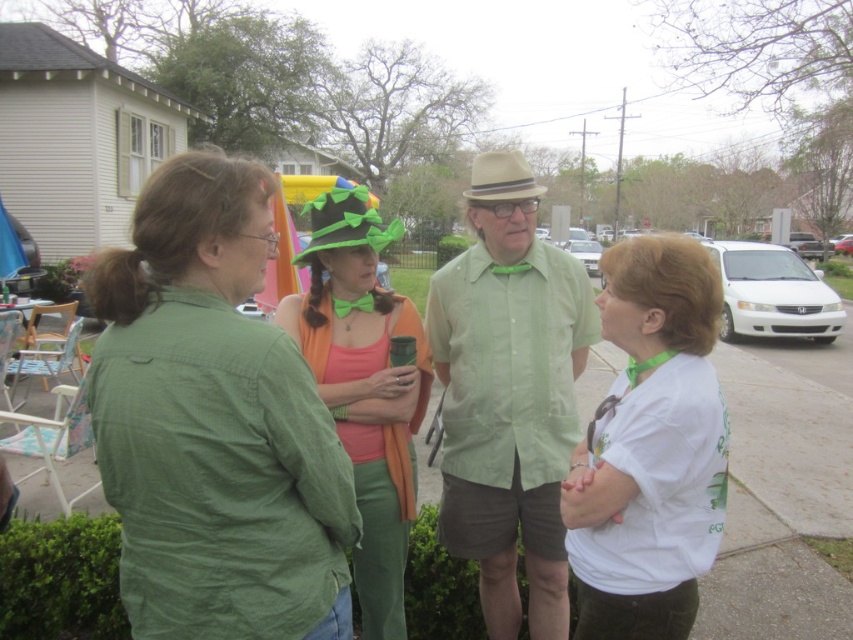
Image resolution: width=853 pixels, height=640 pixels. Describe the element at coordinates (650, 448) in the screenshot. I see `white matte shirt at center` at that location.

From the picture: Does white matte shirt at center come in front of green felt hat at center?

No, white matte shirt at center is further to the viewer.

Is point (625, 600) closer to viewer compared to point (392, 474)?

Yes, point (625, 600) is in front of point (392, 474).

At what (x,y) coordinates should I click in order to perform the action: click on white matte shirt at center. Please return your answer as a coordinate pair (x, y). The image size is (853, 640). Looking at the image, I should click on [650, 448].

Which is behind, point (224, 554) or point (358, 406)?

Positioned behind is point (358, 406).

Between point (195, 404) and point (328, 394), which one is positioned behind?

The point (328, 394) is more distant.

Locate an element on the screen. green matte shirt at left is located at coordinates (213, 422).

Can you confirm if green matte shirt at left is shorter than white matte shirt at center?

Yes, green matte shirt at left is shorter than white matte shirt at center.

Does green matte shirt at left have a lesser width compared to white matte shirt at center?

Incorrect, green matte shirt at left's width is not less than white matte shirt at center's.

Does point (160, 189) come closer to viewer compared to point (585, 506)?

That is True.

Locate an element on the screen. The image size is (853, 640). green matte shirt at left is located at coordinates (213, 422).